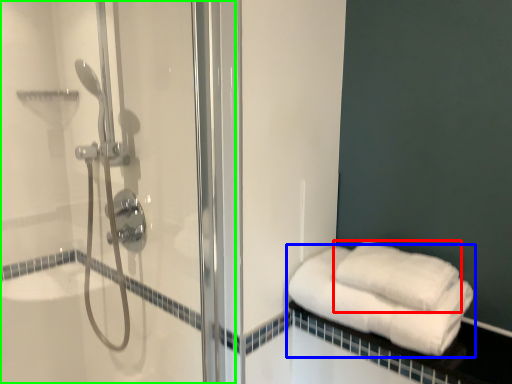
Question: Estimate the real-world distances between objects in this image. Which object is closer to towel (highlighted by a red box), towel (highlighted by a blue box) or shower door (highlighted by a green box)?

Choices:
 (A) towel
 (B) shower door

Answer: (A)